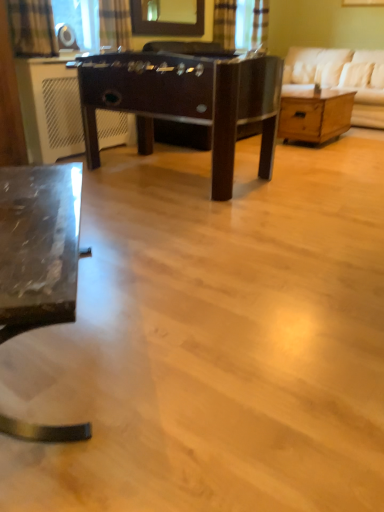
At what (x,y) coordinates should I click in order to perform the action: click on vacant point to the right of metallic glass desk at lower left. Please return your answer as a coordinate pair (x, y). This screenshot has width=384, height=512. Looking at the image, I should click on (215, 330).